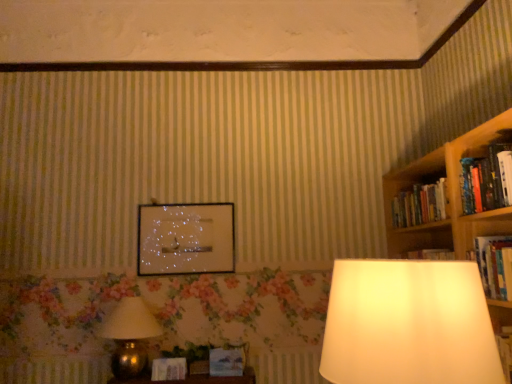
Question: Is glossy glass picture frame at center to the left of gold metallic lamp at lower left from the viewer's perspective?

Choices:
 (A) yes
 (B) no

Answer: (B)

Question: Can you confirm if glossy glass picture frame at center is bigger than gold metallic lamp at lower left?

Choices:
 (A) no
 (B) yes

Answer: (A)

Question: Considering the relative positions of glossy glass picture frame at center and gold metallic lamp at lower left in the image provided, is glossy glass picture frame at center to the right of gold metallic lamp at lower left from the viewer's perspective?

Choices:
 (A) no
 (B) yes

Answer: (B)

Question: Is glossy glass picture frame at center further to the viewer compared to gold metallic lamp at lower left?

Choices:
 (A) yes
 (B) no

Answer: (A)

Question: From a real-world perspective, is glossy glass picture frame at center on gold metallic lamp at lower left?

Choices:
 (A) no
 (B) yes

Answer: (B)

Question: Would you say hardcover book at upper right, which is the second book from bottom to top, is inside or outside matte brown book at lower center, marked as the 1th paperback book in a left-to-right arrangement?

Choices:
 (A) inside
 (B) outside

Answer: (B)

Question: From a real-world perspective, is hardcover book at upper right, which is the second book from bottom to top, above or below matte brown book at lower center, which appears as the 2th paperback book when viewed from the right?

Choices:
 (A) below
 (B) above

Answer: (B)

Question: Looking at their shapes, would you say hardcover book at upper right, placed as the 1th book when sorted from top to bottom, is wider or thinner than matte brown book at lower center, which appears as the 2th paperback book when viewed from the right?

Choices:
 (A) wide
 (B) thin

Answer: (A)

Question: From their relative heights in the image, would you say hardcover book at upper right, which is the second book from bottom to top, is taller or shorter than matte brown book at lower center, which appears as the 2th paperback book when viewed from the right?

Choices:
 (A) short
 (B) tall

Answer: (B)

Question: Considering the positions of glossy glass picture frame at center and wooden bookshelf at right in the image, is glossy glass picture frame at center bigger or smaller than wooden bookshelf at right?

Choices:
 (A) small
 (B) big

Answer: (A)

Question: Is glossy glass picture frame at center situated inside wooden bookshelf at right or outside?

Choices:
 (A) outside
 (B) inside

Answer: (A)

Question: Is glossy glass picture frame at center to the left or to the right of wooden bookshelf at right in the image?

Choices:
 (A) right
 (B) left

Answer: (B)

Question: From their relative heights in the image, would you say glossy glass picture frame at center is taller or shorter than wooden bookshelf at right?

Choices:
 (A) short
 (B) tall

Answer: (B)

Question: Is point (114, 352) positioned closer to the camera than point (395, 200)?

Choices:
 (A) closer
 (B) farther

Answer: (A)

Question: Do you think gold metallic lamp at lower left is within wooden bookshelf at right, or outside of it?

Choices:
 (A) inside
 (B) outside

Answer: (B)